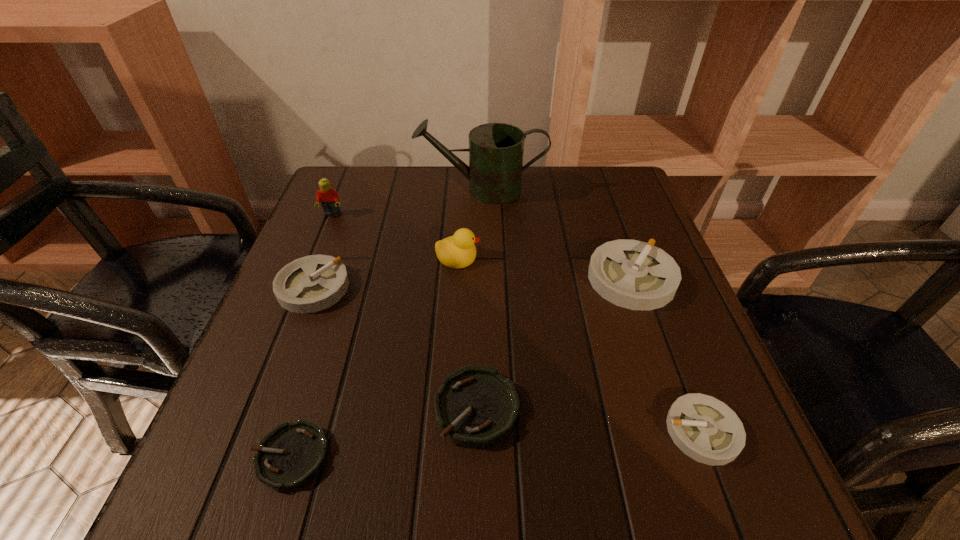
You are a GUI agent. You are given a task and a screenshot of the screen. Output one action in this format:
    pyautogui.click(x=<x>, y=<y>)
    Task: Click on the vacant area that satisfies the following two spatial constraints: 1. on the face of the duckling; 2. on the back side of the nearest gray ashtray
    The image size is (960, 540).
    Given the screenshot: What is the action you would take?
    point(448,431)